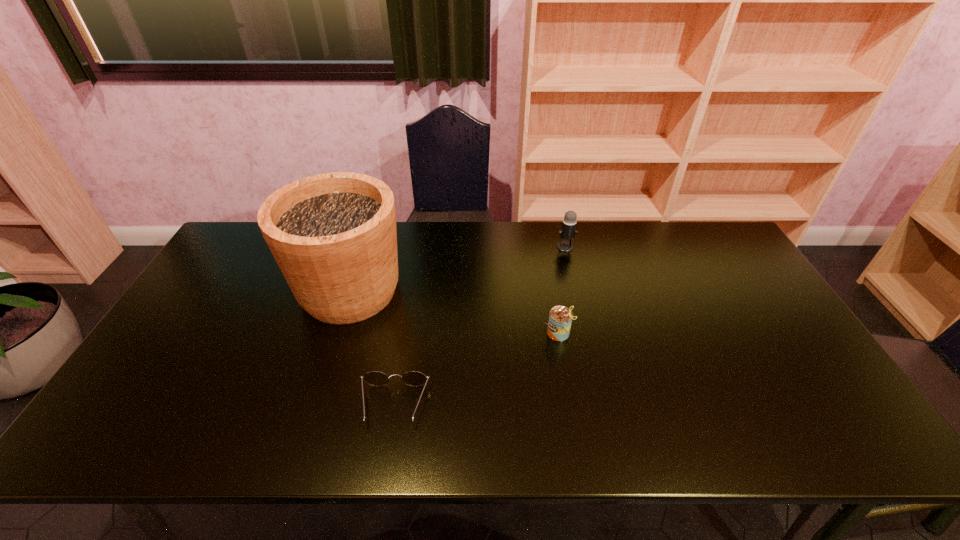
I want to click on vacant space in between the spectacles and the second tallest object, so click(480, 326).

Locate an element on the screen. Image resolution: width=960 pixels, height=540 pixels. free space that is in between the flowerpot and the nearest object is located at coordinates (372, 348).

Identify the location of vacant point located between the shortest object and the rightmost object. Image resolution: width=960 pixels, height=540 pixels. (480, 326).

Find the location of `empty location between the shortest object and the can`. empty location between the shortest object and the can is located at coordinates (476, 369).

Identify the location of free space between the farthest object and the nearest object. The image size is (960, 540). (480, 326).

Locate an element on the screen. The width and height of the screenshot is (960, 540). unoccupied position between the farthest object and the tallest object is located at coordinates (458, 269).

Find the location of `empty space between the third object from left to right and the rightmost object`. empty space between the third object from left to right and the rightmost object is located at coordinates (562, 290).

Find the location of a particular element. vacant area that lies between the flowerpot and the second shortest object is located at coordinates (454, 312).

The width and height of the screenshot is (960, 540). Identify the location of vacant region between the spectacles and the microphone. 480,326.

Select which object appears as the third closest to the tallest object. Please provide its 2D coordinates. Your answer should be formatted as a tuple, i.e. [(x, y)], where the tuple contains the x and y coordinates of a point satisfying the conditions above.

[(568, 231)]